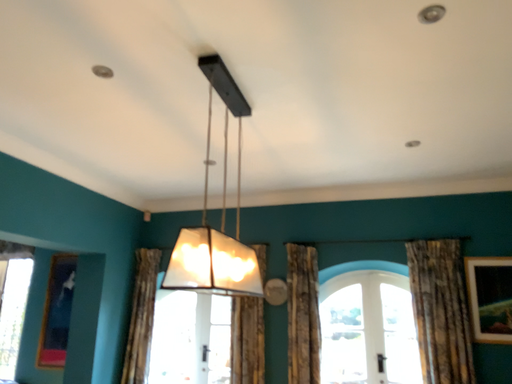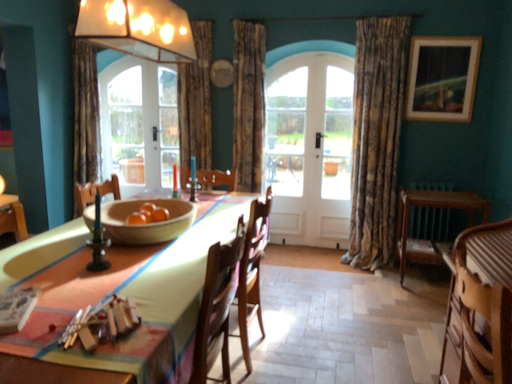
Question: Which way did the camera rotate in the video?

Choices:
 (A) rotated upward
 (B) rotated downward

Answer: (B)